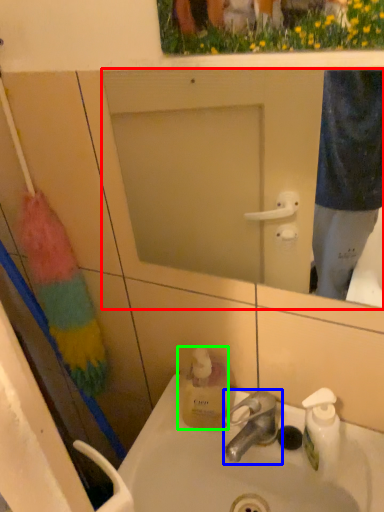
Question: Considering the real-world distances, which object is closest to mirror (highlighted by a red box)? tap (highlighted by a blue box) or bottle (highlighted by a green box).

Choices:
 (A) tap
 (B) bottle

Answer: (B)